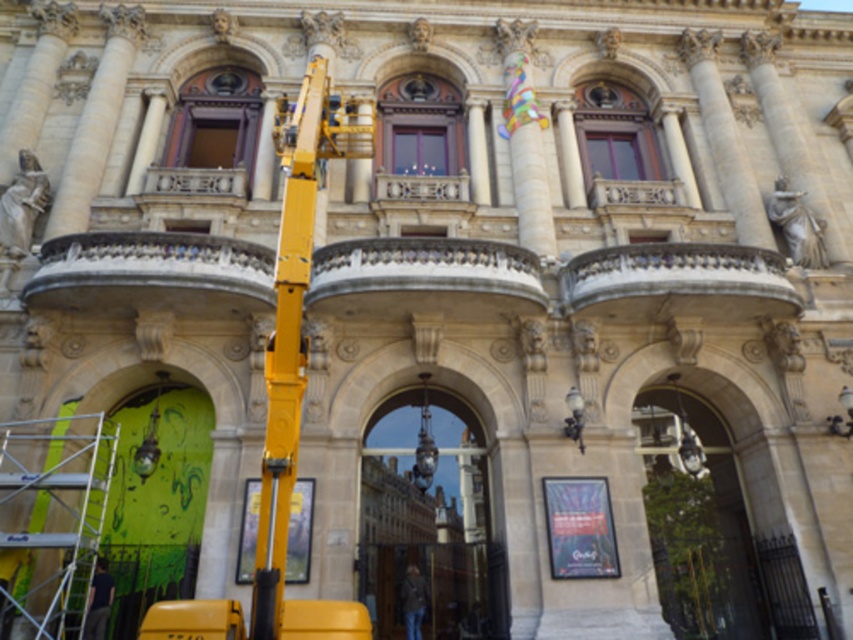
Is yellow metallic crane at left wider than dark blue jeans at lower left?

Correct, the width of yellow metallic crane at left exceeds that of dark blue jeans at lower left.

Who is more distant from viewer, (277,236) or (102,561)?

Point (277,236)

Does point (291, 340) come closer to viewer compared to point (90, 596)?

Yes, it is.

Locate an element on the screen. yellow metallic crane at left is located at coordinates (297, 353).

Does silver metallic scaffolding at lower left have a larger size compared to dark blue jeans at lower left?

Correct, silver metallic scaffolding at lower left is larger in size than dark blue jeans at lower left.

What do you see at coordinates (51, 520) in the screenshot?
I see `silver metallic scaffolding at lower left` at bounding box center [51, 520].

The image size is (853, 640). I want to click on silver metallic scaffolding at lower left, so click(x=51, y=520).

Could you measure the distance between silver metallic scaffolding at lower left and dark brown leather jacket at lower center?

silver metallic scaffolding at lower left and dark brown leather jacket at lower center are 88.14 feet apart.

Is point (10, 465) farther from camera compared to point (410, 602)?

No.

Image resolution: width=853 pixels, height=640 pixels. In order to click on silver metallic scaffolding at lower left in this screenshot , I will do [51, 520].